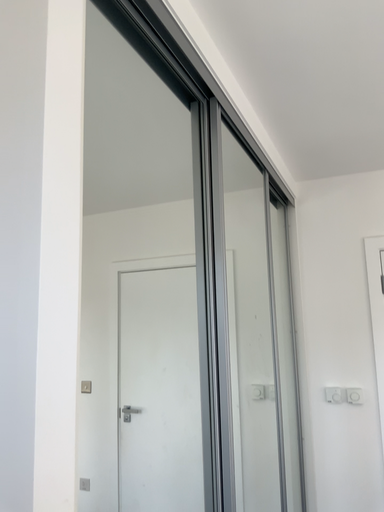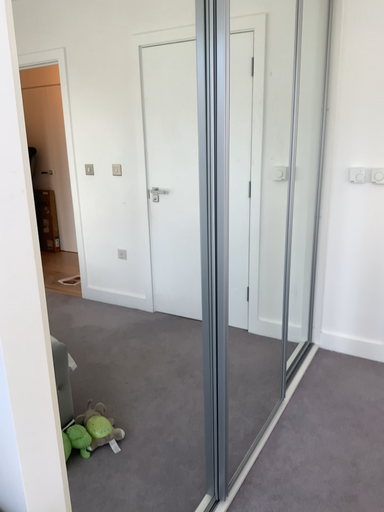
Question: How did the camera likely rotate when shooting the video?

Choices:
 (A) rotated downward
 (B) rotated upward

Answer: (A)